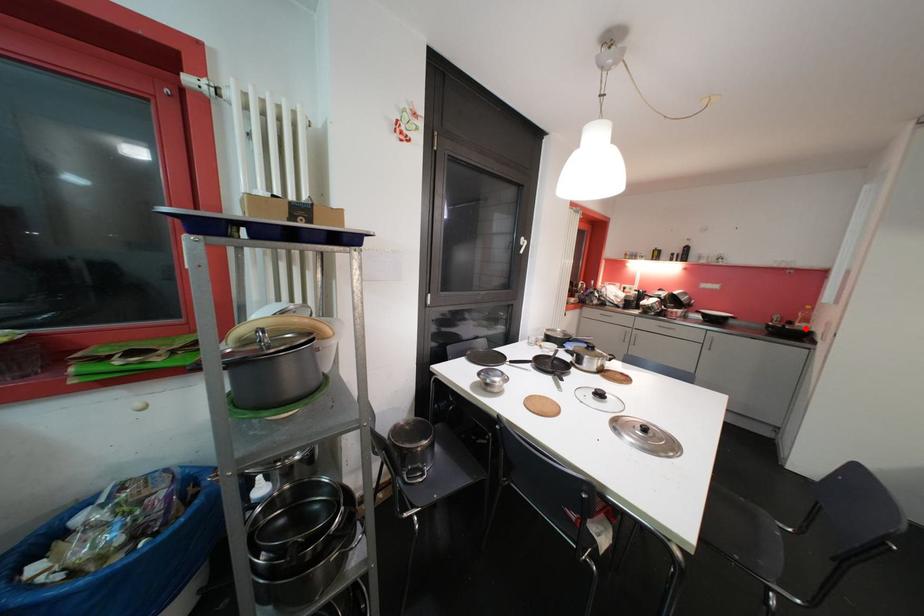
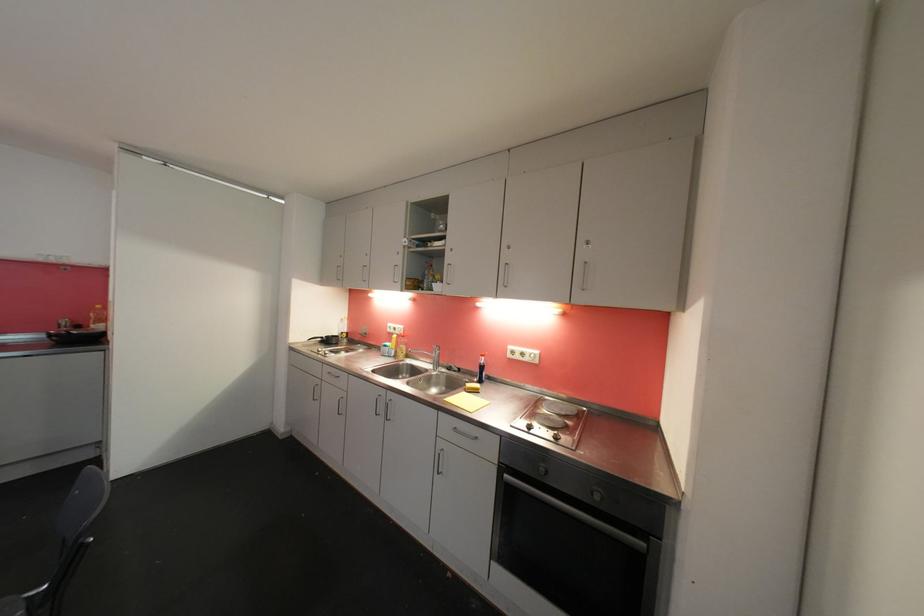
In the second image, find the point that corresponds to the highlighted location in the first image.

(102, 330)